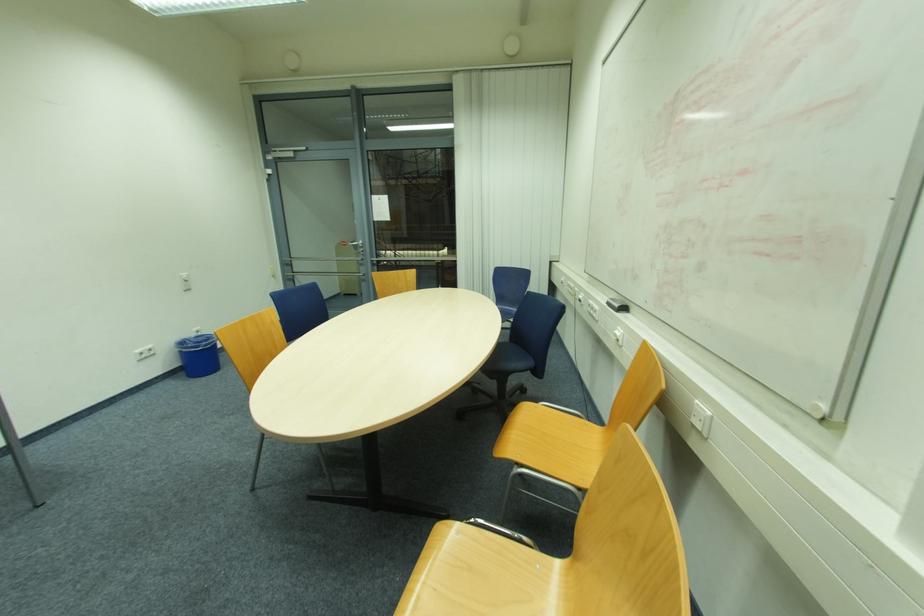
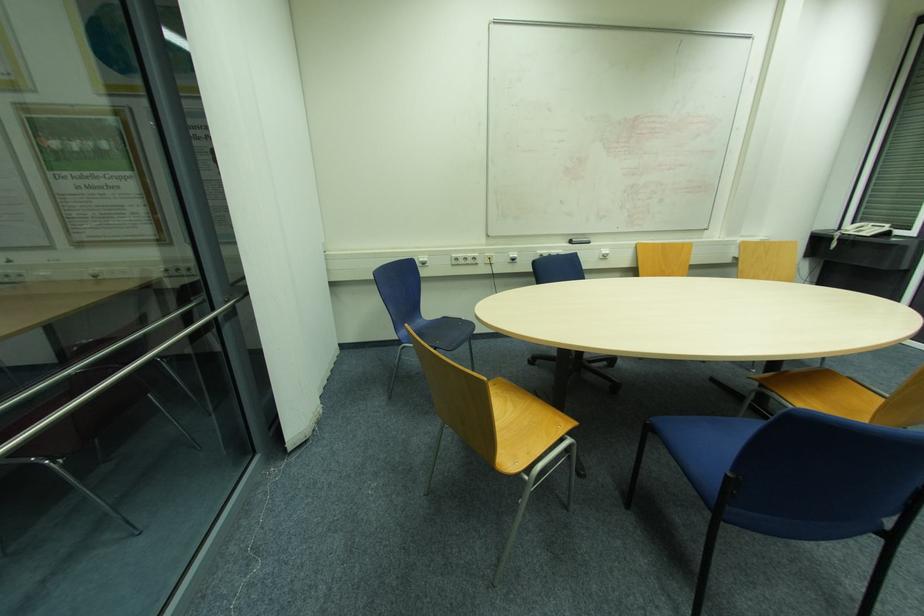
In the second image, find the point that corresponds to point (611, 305) in the first image.

(574, 244)